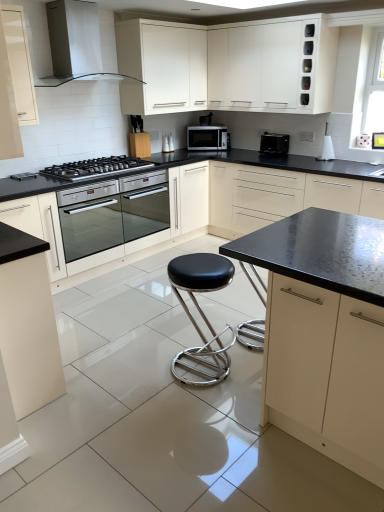
Question: Considering the positions of matte white cabinet at lower left, which is the fifth cabinetry from right to left, and white glossy range hood at upper left in the image, is matte white cabinet at lower left, which is the fifth cabinetry from right to left, taller or shorter than white glossy range hood at upper left?

Choices:
 (A) tall
 (B) short

Answer: (A)

Question: From the image's perspective, is matte white cabinet at lower left, which is the fifth cabinetry from right to left, located above or below white glossy range hood at upper left?

Choices:
 (A) below
 (B) above

Answer: (A)

Question: Based on their relative distances, which object is farther from the black stainless steel gas stove at left?

Choices:
 (A) matte cream cabinet at upper left, the first cabinetry from the left
 (B) matte black countertop at center, the 1th cabinetry in the right-to-left sequence
 (C) white glossy cabinet at upper center, acting as the third cabinetry starting from the right
 (D) white glossy range hood at upper left
 (E) black leather stool at center

Answer: (E)

Question: Which object is positioned farthest from the white glossy range hood at upper left?

Choices:
 (A) stainless steel oven at center
 (B) black matte cabinet at center, which is counted as the 2th cabinetry, starting from the right
 (C) black stainless steel gas stove at left
 (D) white glossy cabinet at upper center, marked as the third cabinetry in a left-to-right arrangement
 (E) black plastic toaster at upper right, which is the 1th kitchen appliance in front-to-back order

Answer: (B)